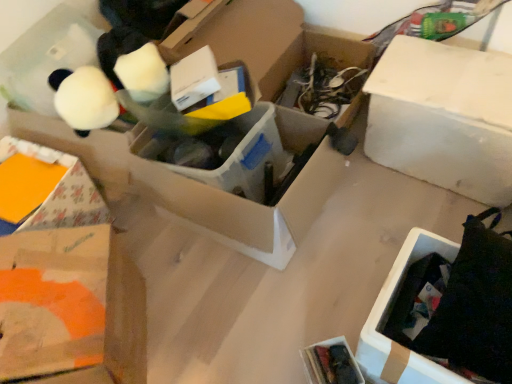
Question: In terms of height, does white matte box at upper right look taller or shorter compared to black cardboard box at lower right?

Choices:
 (A) tall
 (B) short

Answer: (A)

Question: Is white matte box at upper right wider or thinner than black cardboard box at lower right?

Choices:
 (A) wide
 (B) thin

Answer: (B)

Question: Relative to black cardboard box at lower right, is white matte box at upper right in front or behind?

Choices:
 (A) behind
 (B) front

Answer: (A)

Question: Does point (395, 276) appear closer or farther from the camera than point (508, 200)?

Choices:
 (A) farther
 (B) closer

Answer: (B)

Question: In terms of width, does black cardboard box at lower right look wider or thinner when compared to white matte box at upper right?

Choices:
 (A) wide
 (B) thin

Answer: (A)

Question: Based on their positions, is black cardboard box at lower right located to the left or right of white matte box at upper right?

Choices:
 (A) left
 (B) right

Answer: (A)

Question: From a real-world perspective, is black cardboard box at lower right above or below white matte box at upper right?

Choices:
 (A) above
 (B) below

Answer: (B)